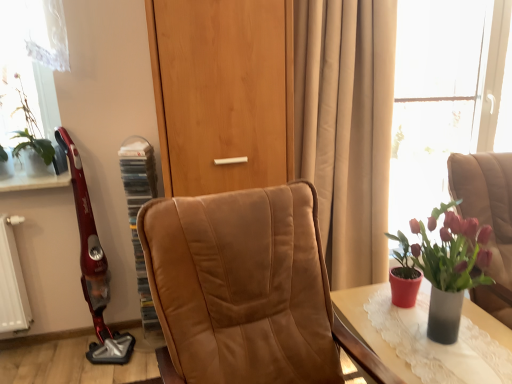
Identify the location of blank space situated above matte gray table at lower right (from a real-world perspective). (423, 332).